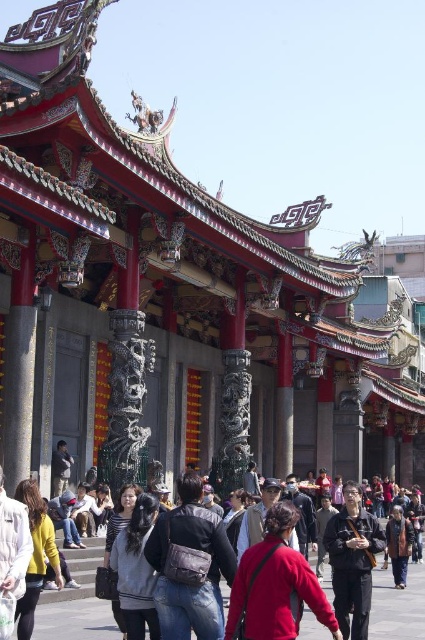
You are standing in front of the traditional Chinese temple and notice a dark gray fabric jacket at center. Based on its position, can you determine if it is closer to the entrance pillars or the decorative roof elements?

The dark gray fabric jacket at center is located at point (353, 561), which places it closer to the entrance pillars than the decorative roof elements.

Looking at this image, you are standing in front of the traditional Chinese temple and notice two points marked in the scene. Which point is closer to you, point (343, 612) or point (399, 509)?

Point (343, 612) is closer to the viewer than point (399, 509).